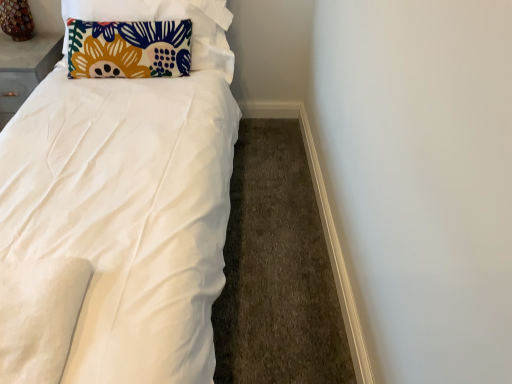
Question: Can you confirm if wooden table lamp at upper left is thinner than matte gray table at upper left?

Choices:
 (A) yes
 (B) no

Answer: (A)

Question: Is wooden table lamp at upper left facing towards matte gray table at upper left?

Choices:
 (A) no
 (B) yes

Answer: (A)

Question: Are wooden table lamp at upper left and matte gray table at upper left far apart?

Choices:
 (A) yes
 (B) no

Answer: (B)

Question: Considering the relative sizes of wooden table lamp at upper left and matte gray table at upper left in the image provided, is wooden table lamp at upper left shorter than matte gray table at upper left?

Choices:
 (A) no
 (B) yes

Answer: (B)

Question: Would you say matte gray table at upper left is part of wooden table lamp at upper left's contents?

Choices:
 (A) no
 (B) yes

Answer: (A)

Question: Is wooden table lamp at upper left outside of matte gray table at upper left?

Choices:
 (A) yes
 (B) no

Answer: (A)

Question: Is white smooth baseboard at lower right a part of wooden table lamp at upper left?

Choices:
 (A) yes
 (B) no

Answer: (B)

Question: Is wooden table lamp at upper left aimed at white smooth baseboard at lower right?

Choices:
 (A) no
 (B) yes

Answer: (A)

Question: Is wooden table lamp at upper left behind white smooth baseboard at lower right?

Choices:
 (A) no
 (B) yes

Answer: (B)

Question: Is wooden table lamp at upper left to the right of white smooth baseboard at lower right from the viewer's perspective?

Choices:
 (A) no
 (B) yes

Answer: (A)

Question: From the image's perspective, is wooden table lamp at upper left under white smooth baseboard at lower right?

Choices:
 (A) no
 (B) yes

Answer: (A)

Question: Does wooden table lamp at upper left lie in front of white smooth baseboard at lower right?

Choices:
 (A) yes
 (B) no

Answer: (B)

Question: Is the surface of matte gray table at upper left in direct contact with wooden table lamp at upper left?

Choices:
 (A) no
 (B) yes

Answer: (A)